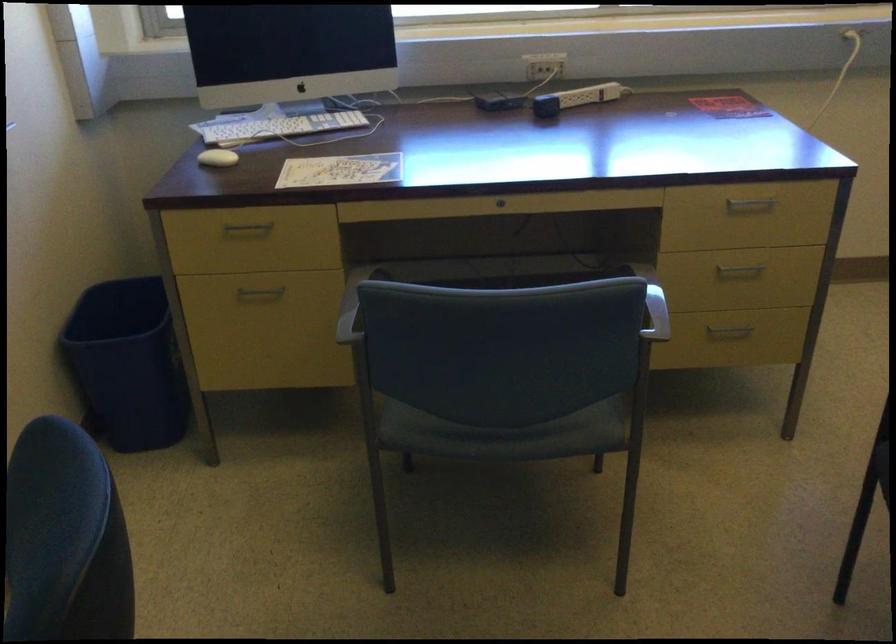
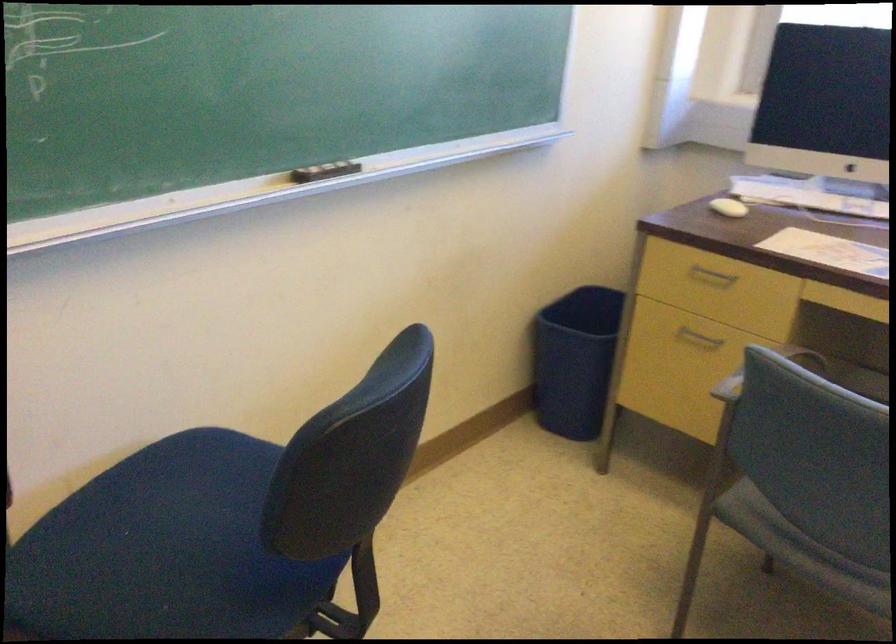
In the second image, find the point that corresponds to point (255, 299) in the first image.

(698, 337)